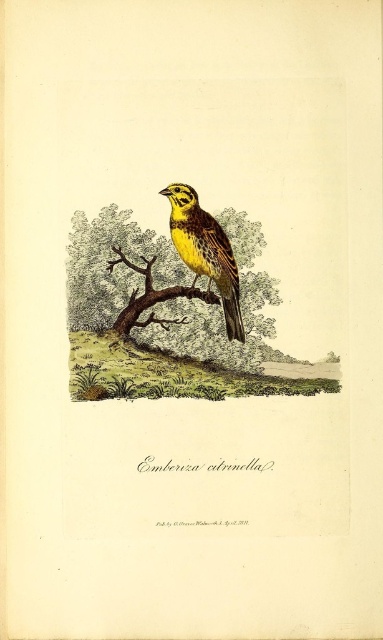
Which is below, brown textured branch at center or brown wood at center?

brown wood at center is below.

Is brown textured branch at center bigger than brown wood at center?

Yes.

This screenshot has height=640, width=383. Identify the location of brown textured branch at center. (166, 289).

Which of these two, yellow matte bird at center or brown wood at center, stands shorter?

brown wood at center

Is yellow matte bird at center taller than brown wood at center?

Indeed, yellow matte bird at center has a greater height compared to brown wood at center.

Between point (183, 211) and point (144, 269), which one is positioned behind?

The point (144, 269) is more distant.

This screenshot has width=383, height=640. In order to click on yellow matte bird at center in this screenshot , I will do `click(206, 252)`.

Consider the image. Can you confirm if brown textured branch at center is thinner than yellow matte bird at center?

No, brown textured branch at center is not thinner than yellow matte bird at center.

What do you see at coordinates (166, 289) in the screenshot? I see `brown textured branch at center` at bounding box center [166, 289].

The image size is (383, 640). In order to click on brown textured branch at center in this screenshot , I will do `click(166, 289)`.